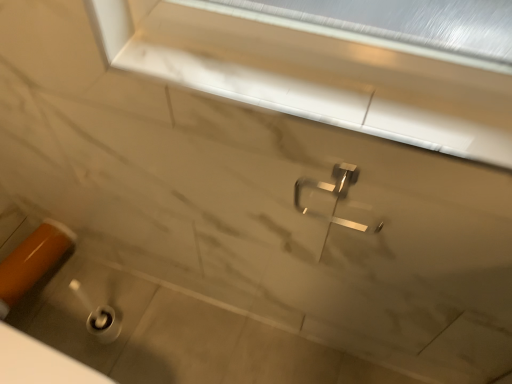
Question: Do you think polished metallic tap at center is within white marble window frame at upper center, or outside of it?

Choices:
 (A) outside
 (B) inside

Answer: (A)

Question: In terms of width, does polished metallic tap at center look wider or thinner when compared to white marble window frame at upper center?

Choices:
 (A) thin
 (B) wide

Answer: (A)

Question: Estimate the real-world distances between objects in this image. Which object is closer to the orange glossy door handle at lower left?

Choices:
 (A) polished metallic tap at center
 (B) white marble window frame at upper center

Answer: (A)

Question: Estimate the real-world distances between objects in this image. Which object is farther from the orange glossy door handle at lower left?

Choices:
 (A) white marble window frame at upper center
 (B) polished metallic tap at center

Answer: (A)